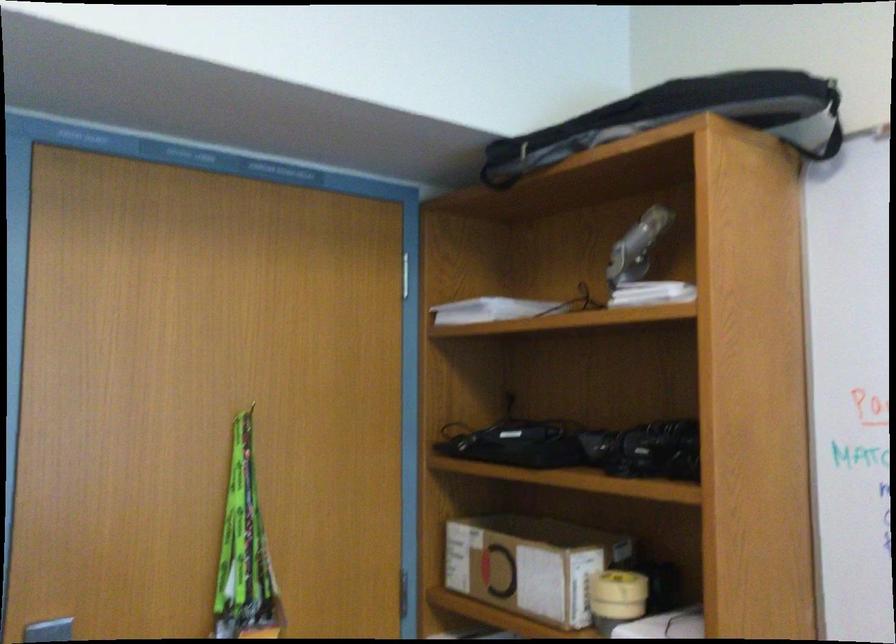
The image size is (896, 644). In order to click on black bag handle in this screenshot , I will do `click(829, 129)`.